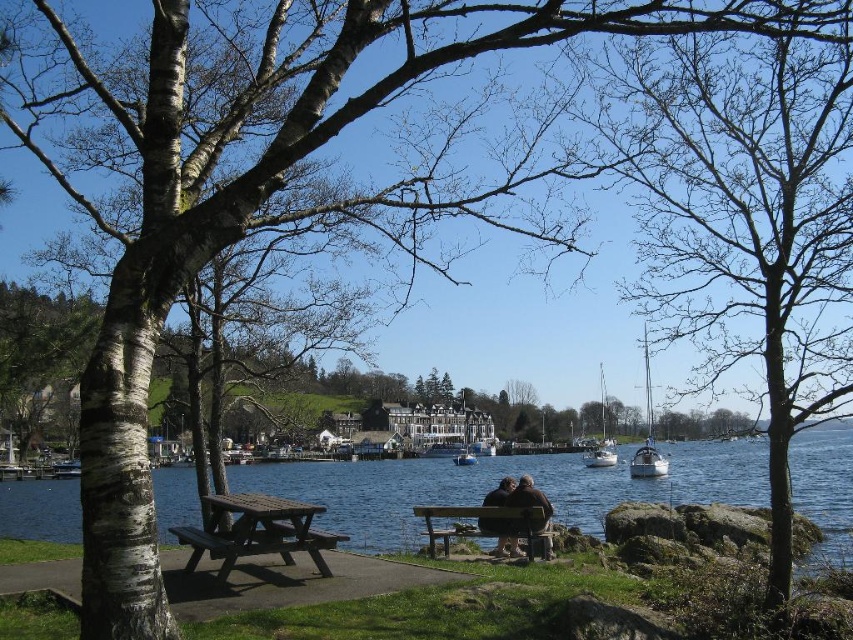
Can you confirm if brown leather bench at center is positioned to the right of white glossy boat at center?

No, brown leather bench at center is not to the right of white glossy boat at center.

Can you confirm if brown leather bench at center is positioned to the left of white glossy boat at center?

Yes, brown leather bench at center is to the left of white glossy boat at center.

Is point (495, 499) positioned after point (466, 429)?

No, it is in front of (466, 429).

The image size is (853, 640). Identify the location of brown leather bench at center. tap(520, 499).

Who is taller, blue water at center or white glossy sailboat at right?

white glossy sailboat at right

Is point (407, 518) behind point (631, 474)?

No, it is not.

Image resolution: width=853 pixels, height=640 pixels. What do you see at coordinates (495, 483) in the screenshot?
I see `blue water at center` at bounding box center [495, 483].

This screenshot has height=640, width=853. In order to click on blue water at center in this screenshot , I will do `click(495, 483)`.

Is point (498, 496) closer to camera compared to point (466, 417)?

Yes, it is.

Consider the image. Which of these two, brown leather jacket at center or white glossy boat at center, stands taller?

Standing taller between the two is white glossy boat at center.

Find the location of a particular element. brown leather jacket at center is located at coordinates [x=498, y=532].

Locate an element on the screen. The image size is (853, 640). brown leather jacket at center is located at coordinates (498, 532).